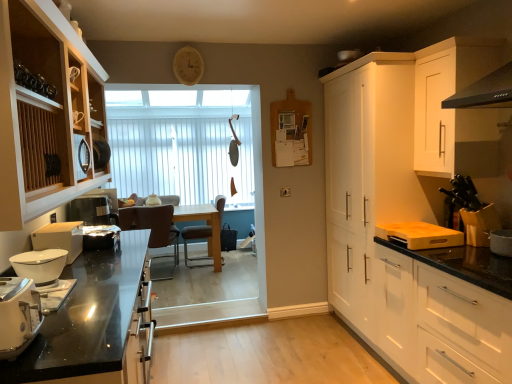
Measure the distance between point (x=205, y=257) and camera.

Point (x=205, y=257) is 19.69 feet away from camera.

The image size is (512, 384). Describe the element at coordinates (396, 176) in the screenshot. I see `white matte cabinet at right, the 2th cabinetry viewed from the left` at that location.

The width and height of the screenshot is (512, 384). What are the coordinates of `white matte cabinet at right, positioned as the 2th cabinetry in right-to-left order` in the screenshot? It's located at click(x=441, y=323).

Measure the distance between point (250, 190) and camera.

The depth of point (250, 190) is 16.04 feet.

The width and height of the screenshot is (512, 384). Identify the location of black glass countertop at lower left. (92, 322).

Between white matte cabinet at right, which ranks as the third cabinetry in right-to-left order, and white matte cabinet at upper right, which is counted as the 1th cabinetry, starting from the right, which one has more height?

With more height is white matte cabinet at right, which ranks as the third cabinetry in right-to-left order.

Considering the sizes of objects white matte cabinet at right, the 2th cabinetry viewed from the left, and white matte cabinet at upper right, which is counted as the 1th cabinetry, starting from the right, in the image provided, who is smaller, white matte cabinet at right, the 2th cabinetry viewed from the left, or white matte cabinet at upper right, which is counted as the 1th cabinetry, starting from the right,?

With smaller size is white matte cabinet at upper right, which is counted as the 1th cabinetry, starting from the right.

Which object is thinner, white matte cabinet at right, which ranks as the third cabinetry in right-to-left order, or white matte cabinet at upper right, which is counted as the 1th cabinetry, starting from the right?

white matte cabinet at upper right, which is counted as the 1th cabinetry, starting from the right, is thinner.

Which point is more distant from viewer, (x=336, y=109) or (x=470, y=127)?

Point (x=336, y=109)

How many degrees apart are the facing directions of white glossy bowl at left, positioned as the 1th kitchen appliance in back-to-front order, and white glossy bowl at left, acting as the second kitchen appliance starting from the front?

The angular difference between white glossy bowl at left, positioned as the 1th kitchen appliance in back-to-front order, and white glossy bowl at left, acting as the second kitchen appliance starting from the front, is 0.3 degrees.

Between white glossy bowl at left, which is the 3th kitchen appliance in front-to-back order, and white glossy bowl at left, acting as the second kitchen appliance starting from the front, which one appears on the right side from the viewer's perspective?

white glossy bowl at left, acting as the second kitchen appliance starting from the front, is more to the right.

Is white glossy bowl at left, positioned as the 1th kitchen appliance in back-to-front order, oriented towards white glossy bowl at left, arranged as the second kitchen appliance when viewed from the back?

No.

Is point (79, 247) positioned behind point (23, 276)?

Yes, point (79, 247) is farther from viewer.

In the scene shown: Is black glass countertop at lower left located within white glossy bowl at left, acting as the second kitchen appliance starting from the front?

Definitely not — black glass countertop at lower left is not inside white glossy bowl at left, acting as the second kitchen appliance starting from the front.

Which is in front, point (47, 277) or point (60, 366)?

Point (60, 366)

Is white glossy bowl at left, arranged as the second kitchen appliance when viewed from the back, taller or shorter than black glass countertop at lower left?

In the image, white glossy bowl at left, arranged as the second kitchen appliance when viewed from the back, appears to be shorter than black glass countertop at lower left.

Considering the relative positions of white glossy bowl at left, acting as the second kitchen appliance starting from the front, and black glass countertop at lower left in the image provided, is white glossy bowl at left, acting as the second kitchen appliance starting from the front, to the left of black glass countertop at lower left from the viewer's perspective?

Indeed, white glossy bowl at left, acting as the second kitchen appliance starting from the front, is positioned on the left side of black glass countertop at lower left.

Is black glass countertop at lower left bigger or smaller than brown leather chair at center?

Clearly, black glass countertop at lower left is larger in size than brown leather chair at center.

From the image's perspective, is black glass countertop at lower left located beneath brown leather chair at center?

Yes, from the image's perspective, black glass countertop at lower left is beneath brown leather chair at center.

Is black glass countertop at lower left placed right next to brown leather chair at center?

No, black glass countertop at lower left is not touching brown leather chair at center.

Considering the sizes of white ceramic pot at right, acting as the 1th appliance starting from the front, and white matte cabinet at right, positioned as the 3th cabinetry in left-to-right order, in the image, is white ceramic pot at right, acting as the 1th appliance starting from the front, wider or thinner than white matte cabinet at right, positioned as the 3th cabinetry in left-to-right order,?

Considering their sizes, white ceramic pot at right, acting as the 1th appliance starting from the front, looks slimmer than white matte cabinet at right, positioned as the 3th cabinetry in left-to-right order.

Could white matte cabinet at right, positioned as the 2th cabinetry in right-to-left order, be considered to be inside white ceramic pot at right, acting as the 1th appliance starting from the front?

No.

Measure the distance between white ceramic pot at right, the second appliance from the back, and white matte cabinet at right, positioned as the 2th cabinetry in right-to-left order.

The distance of white ceramic pot at right, the second appliance from the back, from white matte cabinet at right, positioned as the 2th cabinetry in right-to-left order, is 21.96 inches.

In the scene shown: Is white ceramic pot at right, acting as the 1th appliance starting from the front, taller than white matte cabinet at right, positioned as the 2th cabinetry in right-to-left order?

In fact, white ceramic pot at right, acting as the 1th appliance starting from the front, may be shorter than white matte cabinet at right, positioned as the 2th cabinetry in right-to-left order.

Which point is more forward, (469, 375) or (136, 238)?

Point (469, 375)

Based on the photo, is white matte cabinet at right, positioned as the 3th cabinetry in left-to-right order, shorter than black glass countertop at lower left?

In fact, white matte cabinet at right, positioned as the 3th cabinetry in left-to-right order, may be taller than black glass countertop at lower left.

Looking at the image, does white matte cabinet at right, positioned as the 3th cabinetry in left-to-right order, seem bigger or smaller compared to black glass countertop at lower left?

Clearly, white matte cabinet at right, positioned as the 3th cabinetry in left-to-right order, is larger in size than black glass countertop at lower left.

Which is correct: white matte cabinet at right, positioned as the 3th cabinetry in left-to-right order, is inside black glass countertop at lower left, or outside of it?

The correct answer is: outside.

From a real-world perspective, is wooden cabinet at left, placed as the 4th cabinetry when sorted from right to left, beneath black glass countertop at lower left?

No, from a real-world perspective, wooden cabinet at left, placed as the 4th cabinetry when sorted from right to left, is not below black glass countertop at lower left.

Considering the sizes of objects wooden cabinet at left, placed as the 4th cabinetry when sorted from right to left, and black glass countertop at lower left in the image provided, who is smaller, wooden cabinet at left, placed as the 4th cabinetry when sorted from right to left, or black glass countertop at lower left?

black glass countertop at lower left is smaller.

Is wooden cabinet at left, which is the first cabinetry in left-to-right order, positioned in front of black glass countertop at lower left?

Yes, the depth of wooden cabinet at left, which is the first cabinetry in left-to-right order, is less than that of black glass countertop at lower left.

Which is closer, (24, 149) or (121, 237)?

Point (24, 149) is closer to the camera than point (121, 237).

Where is `the 2nd cabinetry above the white matte cabinet at right, the 2th cabinetry viewed from the left (from the image's perspective)`? This screenshot has width=512, height=384. the 2nd cabinetry above the white matte cabinet at right, the 2th cabinetry viewed from the left (from the image's perspective) is located at coordinates tap(455, 109).

From the white glossy bowl at left, which is the 3th kitchen appliance in front-to-back order, count 1st kitchen appliance to the right and point to it. Please provide its 2D coordinates.

[(40, 265)]

Which object lies further to the anchor point black glass countertop at lower left, white glossy bowl at left, acting as the second kitchen appliance starting from the front, or white plastic toaster at lower left, positioned as the 1th kitchen appliance in front-to-back order?

white plastic toaster at lower left, positioned as the 1th kitchen appliance in front-to-back order, is further to black glass countertop at lower left.

Which object lies further to the anchor point white vertical blinds at center, brown leather chair at center or white matte cabinet at right, the 2th cabinetry viewed from the left?

Based on the image, white matte cabinet at right, the 2th cabinetry viewed from the left, appears to be further to white vertical blinds at center.

When comparing their distances from white matte cabinet at right, the 2th cabinetry viewed from the left, does wooden cabinet at left, placed as the 4th cabinetry when sorted from right to left, or white ceramic pot at right, acting as the 1th appliance starting from the front, seem closer?

white ceramic pot at right, acting as the 1th appliance starting from the front, lies closer to white matte cabinet at right, the 2th cabinetry viewed from the left, than the other object.

From the image, which object appears to be farther from orange wood cutting board at right, which is the second appliance in front-to-back order, white glossy bowl at left, acting as the second kitchen appliance starting from the front, or white glossy bowl at left, positioned as the 1th kitchen appliance in back-to-front order?

white glossy bowl at left, acting as the second kitchen appliance starting from the front, is further to orange wood cutting board at right, which is the second appliance in front-to-back order.

Estimate the real-world distances between objects in this image. Which object is closer to white matte cabinet at upper right, which is counted as the 1th cabinetry, starting from the right, white matte cabinet at right, the 2th cabinetry viewed from the left, or wooden cabinet at left, placed as the 4th cabinetry when sorted from right to left?

white matte cabinet at right, the 2th cabinetry viewed from the left, lies closer to white matte cabinet at upper right, which is counted as the 1th cabinetry, starting from the right, than the other object.

From the image, which object appears to be nearer to brown leather chair at center, black glass countertop at lower left or white matte cabinet at right, which ranks as the third cabinetry in right-to-left order?

black glass countertop at lower left.

Considering their positions, is wooden cabinet at left, which is the first cabinetry in left-to-right order, positioned closer to white glossy bowl at left, acting as the second kitchen appliance starting from the front, than white ceramic pot at right, which is the 2th appliance from left to right?

wooden cabinet at left, which is the first cabinetry in left-to-right order.

When comparing their distances from white matte cabinet at right, positioned as the 3th cabinetry in left-to-right order, does orange wood cutting board at right, placed as the 1th appliance when sorted from left to right, or white matte cabinet at right, the 2th cabinetry viewed from the left, seem closer?

white matte cabinet at right, the 2th cabinetry viewed from the left, is positioned closer to the anchor white matte cabinet at right, positioned as the 3th cabinetry in left-to-right order.

Image resolution: width=512 pixels, height=384 pixels. What are the coordinates of `kitchen appliance situated between white glossy bowl at left, acting as the second kitchen appliance starting from the front, and orange wood cutting board at right, placed as the first appliance when sorted from back to front, from left to right` in the screenshot? It's located at (18, 315).

The height and width of the screenshot is (384, 512). Identify the location of cabinetry between white glossy bowl at left, acting as the second kitchen appliance starting from the front, and orange wood cutting board at right, placed as the first appliance when sorted from back to front, from left to right. (396, 176).

Locate an element on the screen. countertop between white matte cabinet at right, positioned as the 2th cabinetry in right-to-left order, and brown leather chair at center from front to back is located at coordinates (92, 322).

Locate an element on the screen. The height and width of the screenshot is (384, 512). countertop positioned between white glossy bowl at left, arranged as the second kitchen appliance when viewed from the back, and brown leather chair at center from near to far is located at coordinates (92, 322).